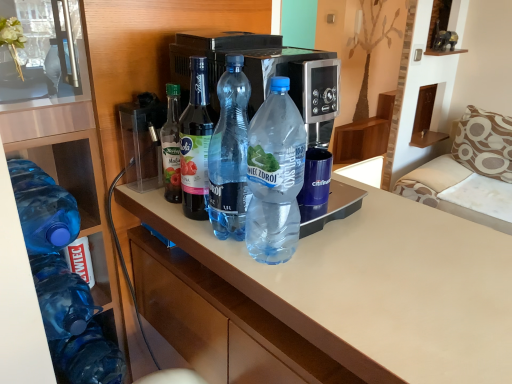
What are the coordinates of `vacant point above translucent plastic bottles at center (from a real-world perspective)` in the screenshot? It's located at (373, 250).